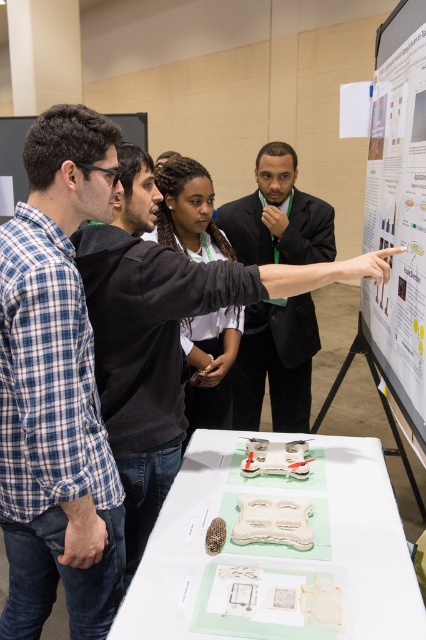
You are standing at the back of the room and want to see the drone model on the table. The blue plaid shirt at left and the black suit at center are blocking your view. Which person should you ask to move so you can see the drone model better?

The blue plaid shirt at left has a lesser height compared to black suit at center, so you should ask the blue plaid shirt at left to move because they are shorter and their position is blocking your view more effectively.

You are an event organizer who needs to arrange seating for a photo opportunity. You have two people in the front row, one wearing a black suit at center and the other wearing a black matte shirt at center. Based on their heights, which person should be seated in the middle to avoid blocking the view of others behind them?

The black suit at center is much taller than the black matte shirt at center. To avoid blocking the view, the taller person should be seated towards the back. Therefore, the black matte shirt at center should be seated in the middle.